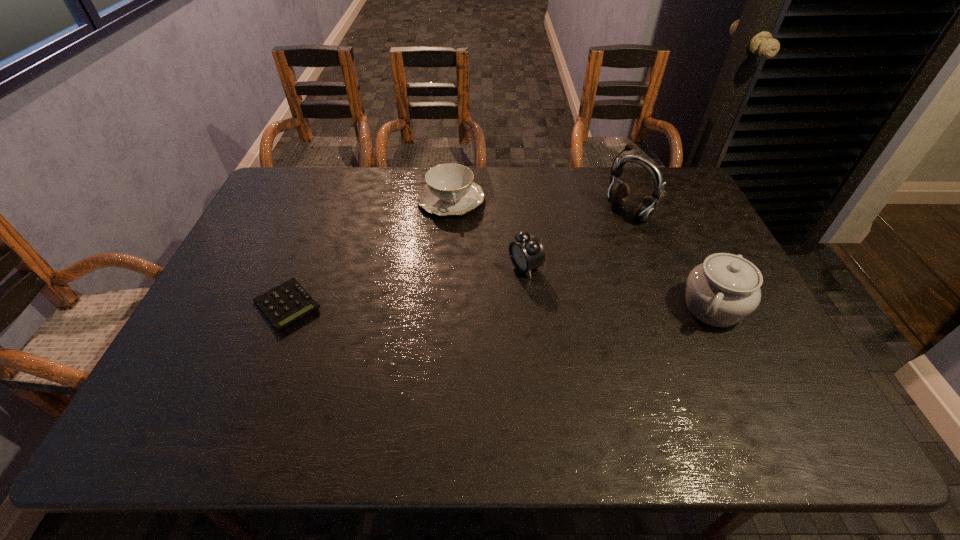
Locate an element on the screen. This screenshot has width=960, height=540. free space at the near left corner of the desktop is located at coordinates click(208, 372).

What are the coordinates of `free space at the near right corner of the desktop` in the screenshot? It's located at click(792, 376).

This screenshot has height=540, width=960. Identify the location of empty location between the left chinaware and the tallest object. (540, 206).

Find the location of `vacant space that is in between the third shortest object and the fourth object from right to left`. vacant space that is in between the third shortest object and the fourth object from right to left is located at coordinates (488, 233).

This screenshot has height=540, width=960. I want to click on unoccupied position between the leftmost object and the nearer chinaware, so click(x=500, y=307).

Locate an element on the screen. vacant point located between the earphone and the fourth tallest object is located at coordinates (540, 206).

What are the coordinates of `empty space between the alarm clock and the fourth shortest object` in the screenshot? It's located at (619, 287).

Where is `free space that is in between the tallest object and the right chinaware`? The width and height of the screenshot is (960, 540). free space that is in between the tallest object and the right chinaware is located at coordinates (670, 260).

The image size is (960, 540). In order to click on unoccupied position between the third tallest object and the nearer chinaware in this screenshot , I will do `click(619, 287)`.

Find the location of a particular element. This screenshot has width=960, height=540. free space between the farther chinaware and the shortest object is located at coordinates (369, 252).